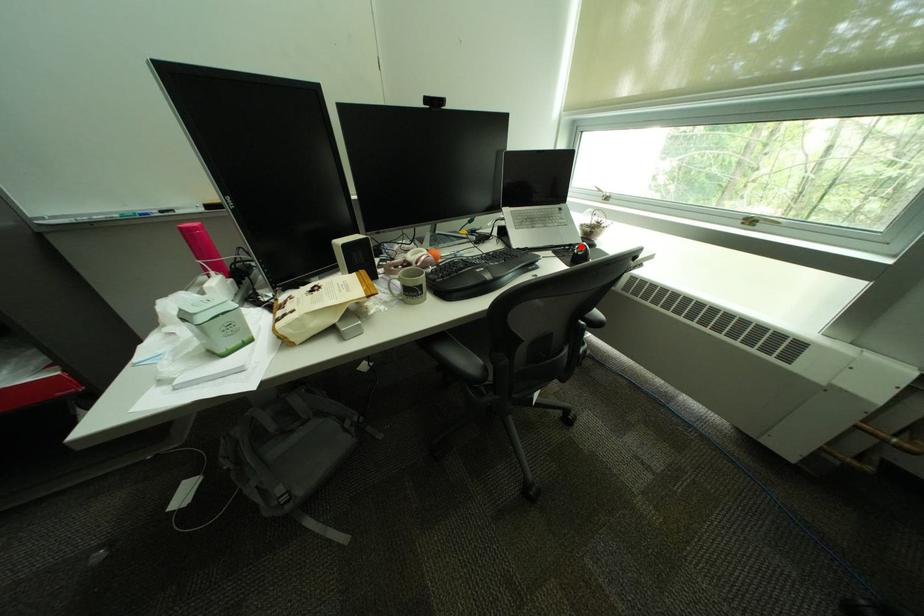
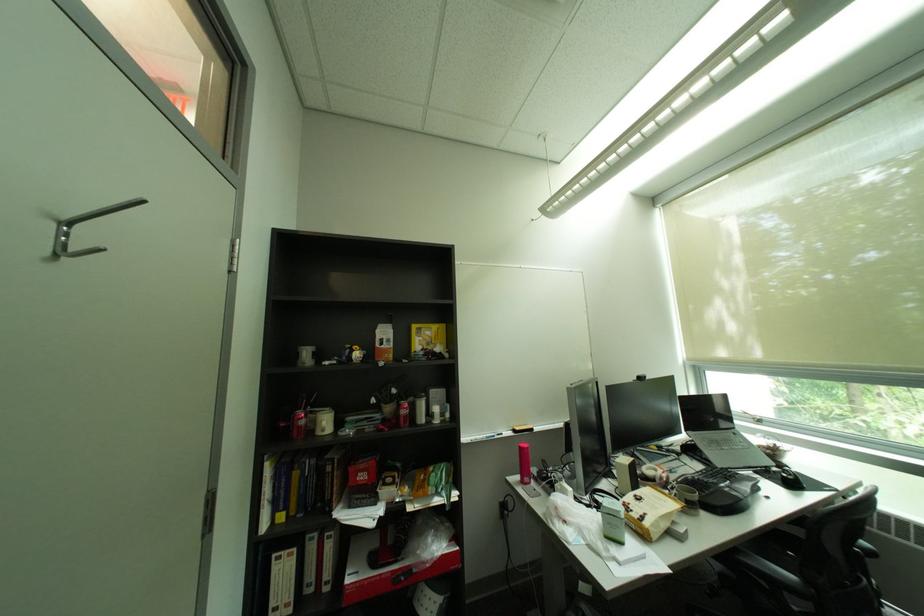
In the second image, find the point that corresponds to the highlighted location in the first image.

(777, 468)